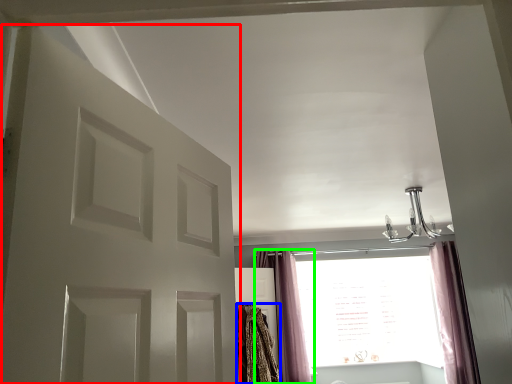
Question: Which is farther away from door (highlighted by a red box)? blanket (highlighted by a blue box) or curtain (highlighted by a green box)?

Choices:
 (A) blanket
 (B) curtain

Answer: (B)